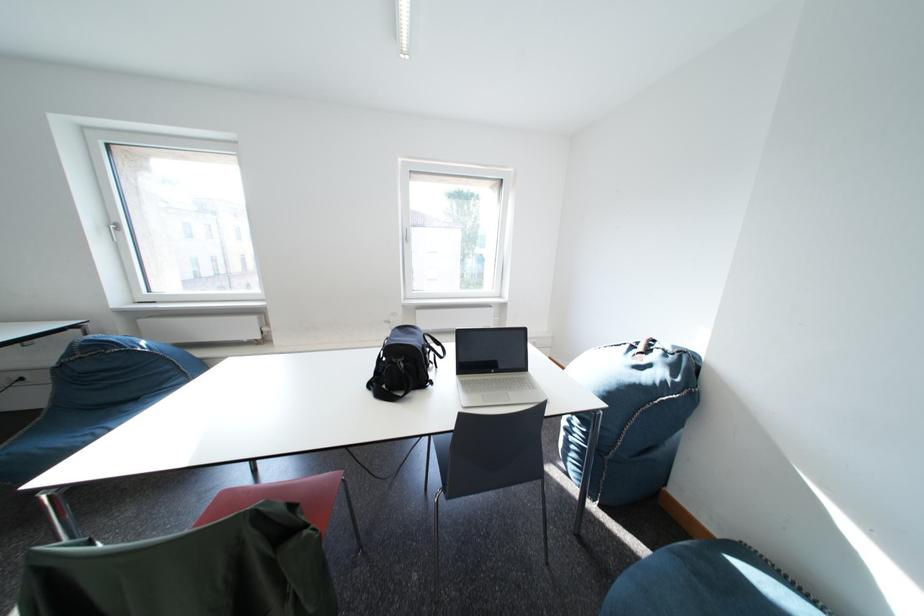
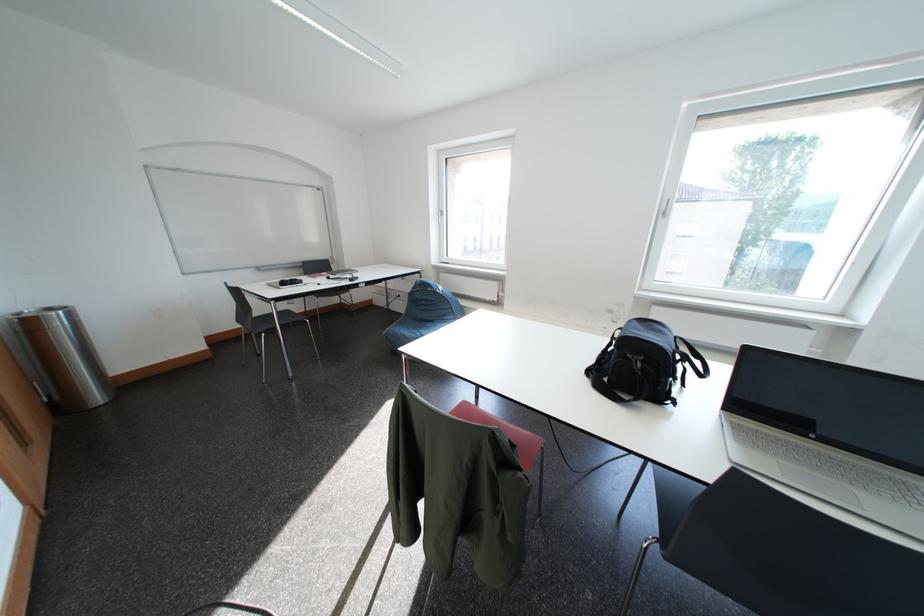
In the second image, find the point that corresponds to pixel 475 387 in the first image.

(747, 431)